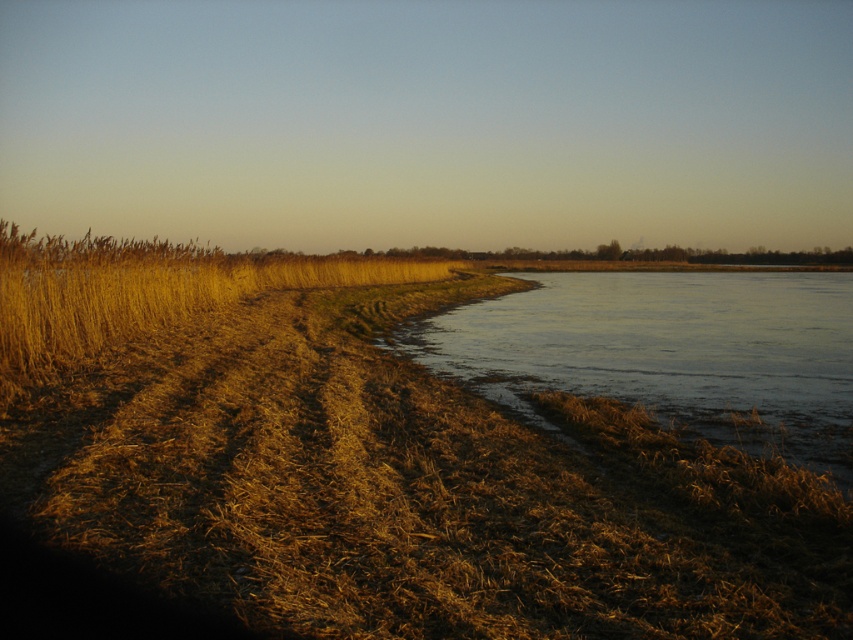
You are a hiker who wants to cross the frozen ice at lower right to reach the other side. However, you notice golden dry grass at left nearby. Which object is closer to your current position?

The golden dry grass at left is closer to your current position because the frozen ice at lower right is positioned on the right side of golden dry grass at left, meaning the grass is between you and the ice.

You are standing in the serene natural landscape depicted in the image. There is a point marked at coordinates (374, 465). Based on the scene description, what does this point most likely represent?

The point at coordinates (374, 465) marks dry grass at left.